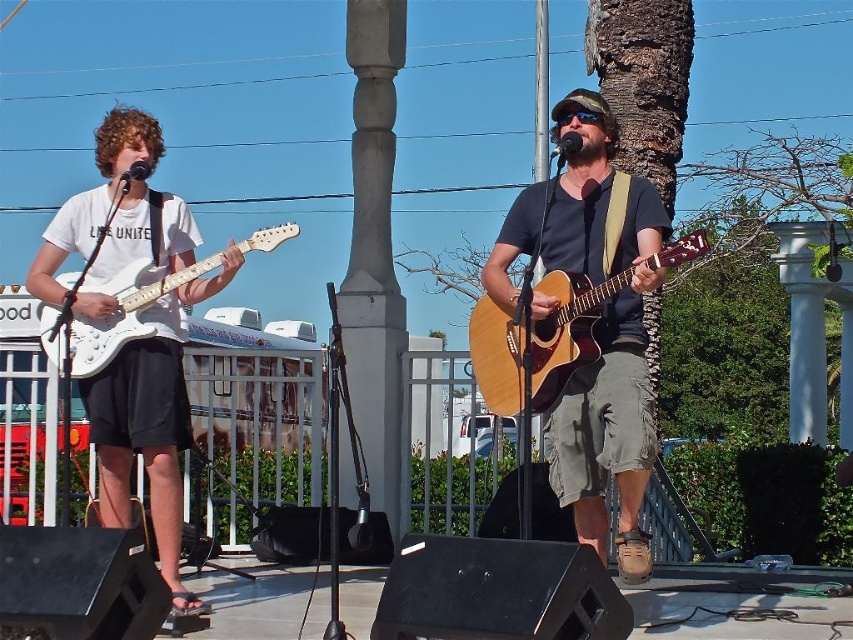
You are a photographer standing at point (537, 340). What object is directly in front of you?

The natural wood acoustic guitar at center is directly in front of you at point (537, 340).

You are a photographer at the back of the audience. You want to take a photo of the white matte guitar at left and the wooden acoustic guitar at center. Based on their positions, which guitar should you focus on first to ensure both are in frame?

The wooden acoustic guitar at center is positioned on the right side of white matte guitar at left, so you should focus on the white matte guitar at left first to ensure both are in frame.

You are a stagehand setting up for a concert and need to place a 1.2 meter long amplifier between the wooden acoustic guitar at center and the white matte guitar at left. Can you fit it there?

The wooden acoustic guitar at center is shorter than the white matte guitar at left, so the distance between them is not specified. However, since the amplifier is 1.2 meters long, it might not fit unless there is sufficient space between the guitars. The answer cannot be determined with the given information.